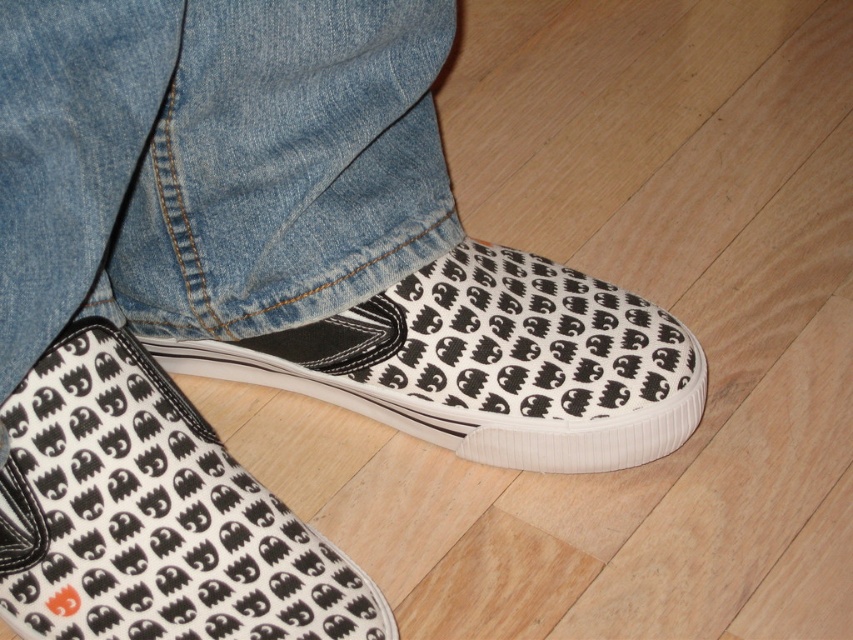
You are designing a shoe display stand and need to place both the white canvas shoe at lower center and the white canvas shoe at center. Which shoe requires a larger area on the display stand?

The white canvas shoe at center requires a larger area on the display stand because it occupies more space than the white canvas shoe at lower center.

You are a photographer trying to capture the white canvas shoe at lower center and the white canvas shoe at center in a single shot. Which shoe should you focus on first to ensure both are in sharp focus?

You should focus on the white canvas shoe at center first because it is farther away from the viewer than the white canvas shoe at lower center, ensuring both will be in focus when focusing on the farther one.

You are standing in front of a wooden floor and see the point at coordinates (151, 515). What object is located at that point?

The white canvas shoe at lower center is located at point (151, 515).